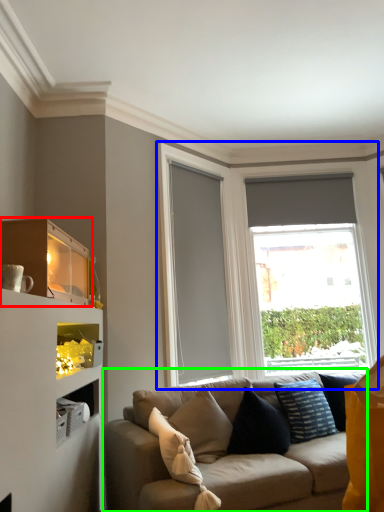
Question: Which object is positioned closest to shelf (highlighted by a red box)? Select from window (highlighted by a blue box) and studio couch (highlighted by a green box).

Choices:
 (A) window
 (B) studio couch

Answer: (B)